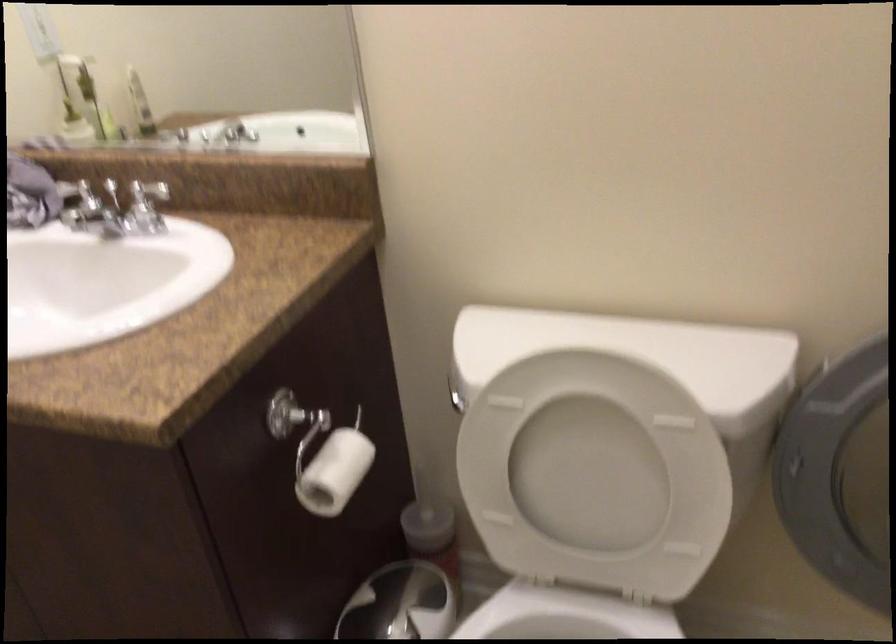
Image resolution: width=896 pixels, height=644 pixels. What do you see at coordinates (564, 616) in the screenshot?
I see `the white toilet seat` at bounding box center [564, 616].